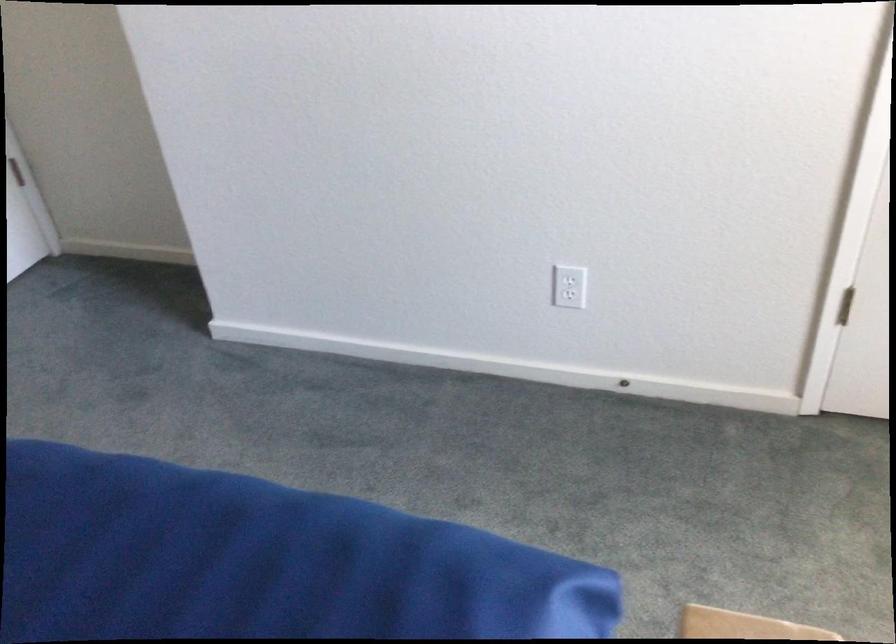
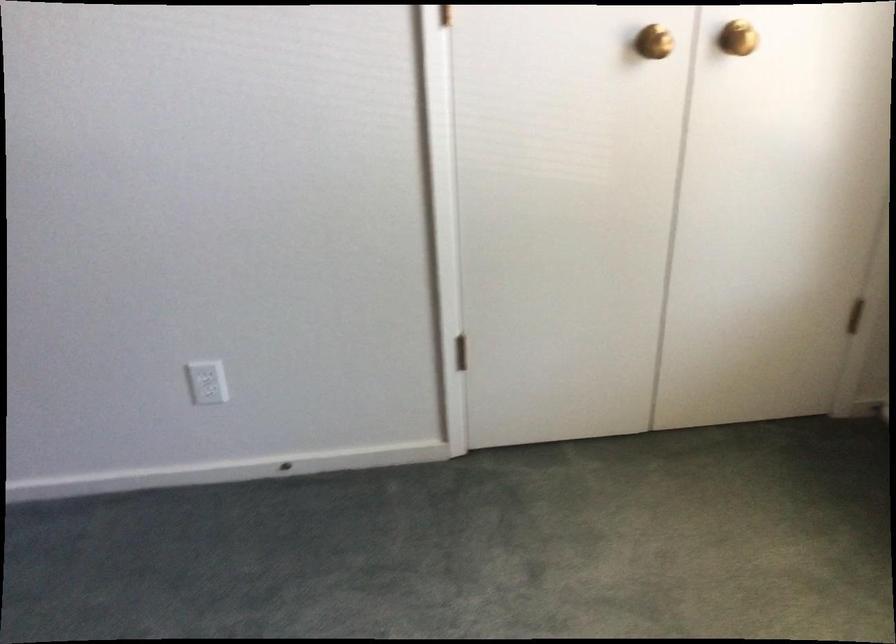
Question: Which direction would the cameraman need to move to produce the second image? Reply with the corresponding letter.

Choices:
 (A) Left
 (B) Right
 (C) Forward
 (D) Backward

Answer: (B)